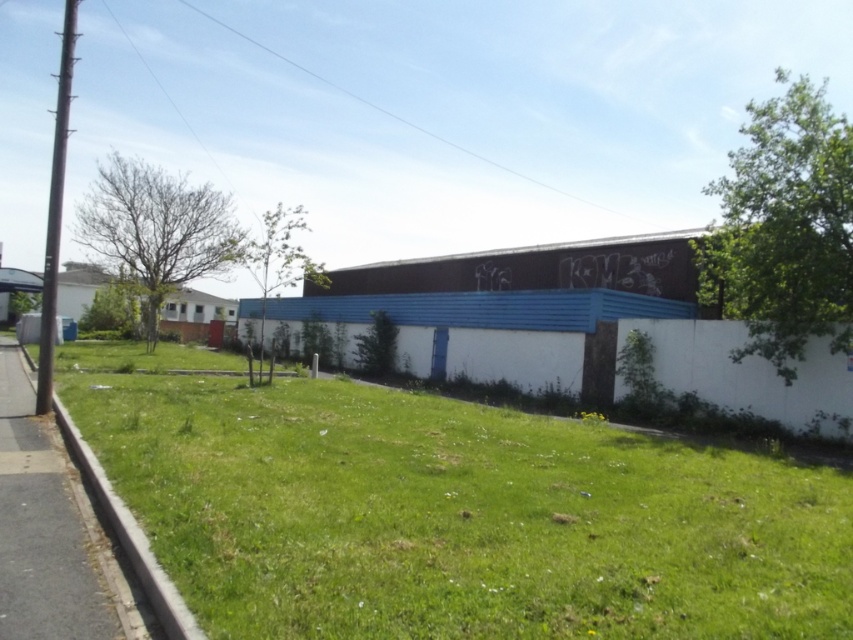
You are standing at the point marked by the coordinates point (x=457, y=515). Looking around, you see the blue door on the white wall with a blue stripe. Which direction should you walk to reach the blue door on the white wall with a blue stripe?

The point (x=457, y=515) is located on the green grassy area at lower left. To reach the blue door on the white wall with a blue stripe, you should walk towards the upper right direction since the blue door is positioned in the middle ground along the left side of the image, opposite to the lower left grassy area.

You are standing on the gray asphalt pavement at lower left and want to step onto the green grassy at lower left. In which direction should you move to reach it?

The green grassy at lower left is located below the gray asphalt pavement at lower left, so you should move downward to reach it.